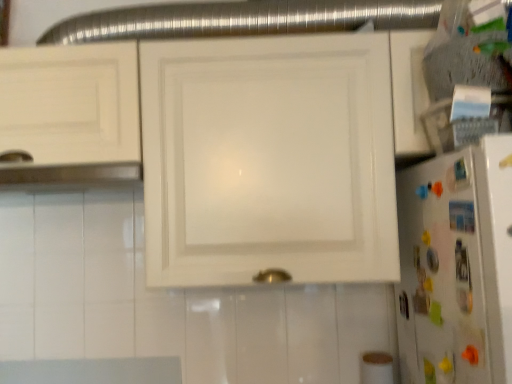
Question: Based on their sizes in the image, would you say white glossy cabinet at center is bigger or smaller than white glossy refrigerator at right?

Choices:
 (A) small
 (B) big

Answer: (B)

Question: Visually, is white glossy cabinet at center positioned to the left or to the right of white glossy refrigerator at right?

Choices:
 (A) right
 (B) left

Answer: (B)

Question: Would you say white glossy cabinet at center is inside or outside white glossy refrigerator at right?

Choices:
 (A) outside
 (B) inside

Answer: (A)

Question: Looking at their shapes, would you say white glossy refrigerator at right is wider or thinner than white glossy cabinet at center?

Choices:
 (A) wide
 (B) thin

Answer: (B)

Question: In the image, is white glossy refrigerator at right on the left side or the right side of white glossy cabinet at center?

Choices:
 (A) left
 (B) right

Answer: (B)

Question: Considering their positions, is white glossy refrigerator at right located in front of or behind white glossy cabinet at center?

Choices:
 (A) front
 (B) behind

Answer: (A)

Question: From a real-world perspective, is white glossy refrigerator at right positioned above or below white glossy cabinet at center?

Choices:
 (A) below
 (B) above

Answer: (A)